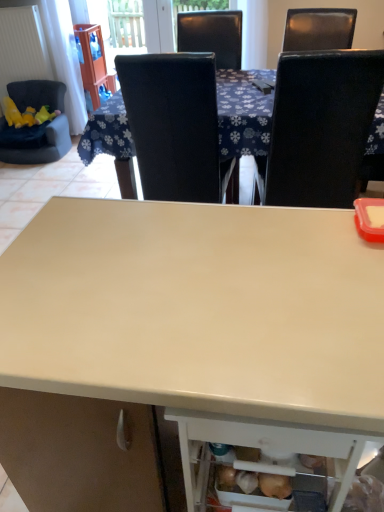
Question: Is black leather chair at upper center, which ranks as the 2th chair in right-to-left order, in front of or behind matte white desk at center in the image?

Choices:
 (A) front
 (B) behind

Answer: (B)

Question: From a real-world perspective, is black leather chair at upper center, the 2th chair positioned from the left, above or below matte white desk at center?

Choices:
 (A) above
 (B) below

Answer: (A)

Question: Which object is the farthest from the matte white desk at center?

Choices:
 (A) black leather chair at upper center, which ranks as the 2th chair in right-to-left order
 (B) white glossy table at center
 (C) black leather chair at upper right, the 3th chair positioned from the left
 (D) velvet dark blue chair at left, positioned as the first chair in left-to-right order

Answer: (D)

Question: Which of these objects is positioned closest to the black leather chair at upper center, the 2th chair positioned from the left?

Choices:
 (A) matte white desk at center
 (B) white glossy table at center
 (C) velvet dark blue chair at left, arranged as the 3th chair when viewed from the right
 (D) black leather chair at upper right, the 1th chair when ordered from right to left

Answer: (B)